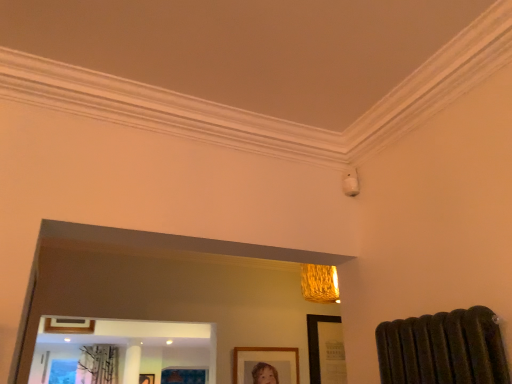
Describe the element at coordinates (266, 365) in the screenshot. I see `wooden picture frame at center` at that location.

What are the coordinates of `wooden picture frame at center` in the screenshot? It's located at (266, 365).

The height and width of the screenshot is (384, 512). I want to click on wooden picture frame at center, so click(x=266, y=365).